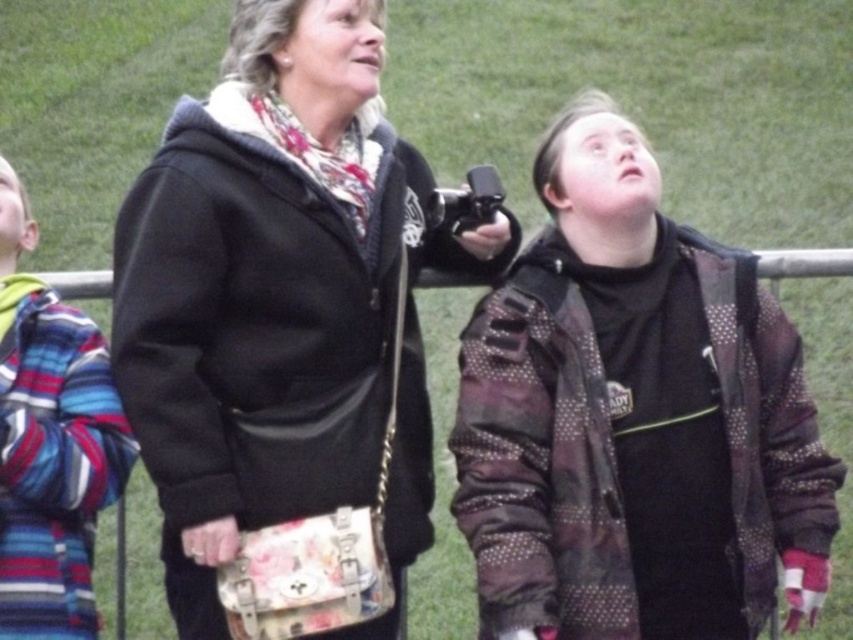
You are a photographer setting up a tripod in the center of the scene. Considering the black fabric jacket at center and the striped wool sweater at left, which object is wider when viewed from your position?

The black fabric jacket at center is wider than the striped wool sweater at left.